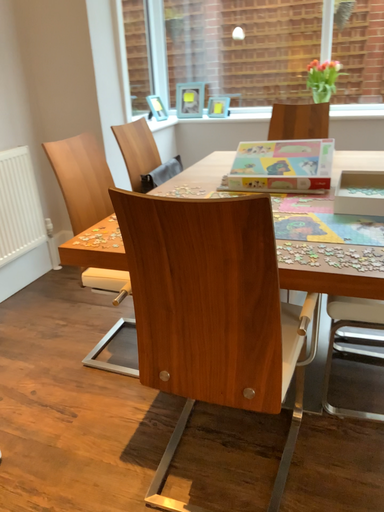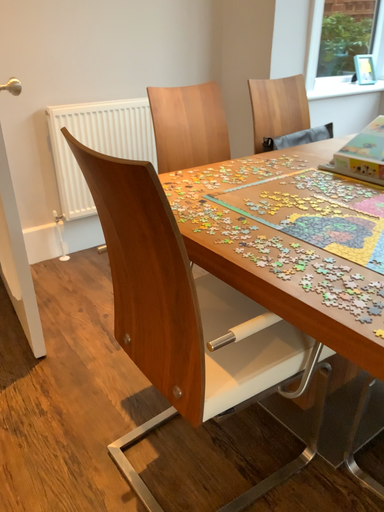
Question: Which way did the camera rotate in the video?

Choices:
 (A) rotated left
 (B) rotated right

Answer: (A)